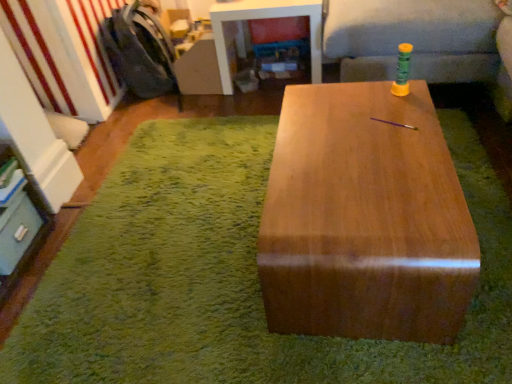
Where is `vacant region below matte gray drawer at lower left (from a real-world perspective)`? This screenshot has height=384, width=512. vacant region below matte gray drawer at lower left (from a real-world perspective) is located at coordinates (33, 256).